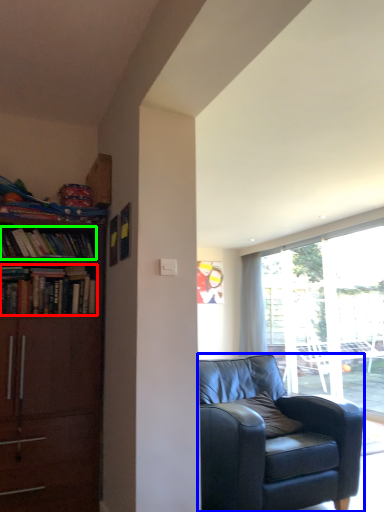
Question: Which is nearer to the book (highlighted by a red box)? chair (highlighted by a blue box) or book (highlighted by a green box).

Choices:
 (A) chair
 (B) book

Answer: (B)